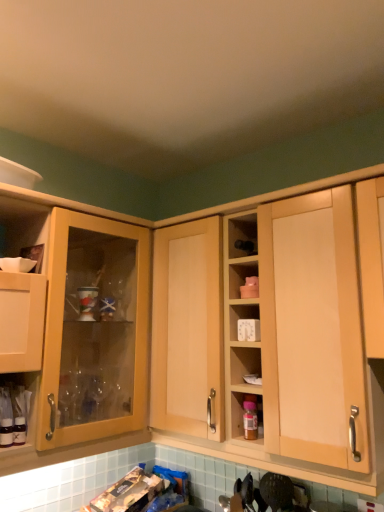
Question: Considering the relative sizes of translucent glass bottles at lower left and matte wood cabinet at left, positioned as the first cabinetry in left-to-right order, in the image provided, is translucent glass bottles at lower left taller than matte wood cabinet at left, positioned as the first cabinetry in left-to-right order,?

Choices:
 (A) no
 (B) yes

Answer: (A)

Question: Is translucent glass bottles at lower left bigger than matte wood cabinet at left, positioned as the 2th cabinetry in right-to-left order?

Choices:
 (A) yes
 (B) no

Answer: (B)

Question: Is translucent glass bottles at lower left turned away from matte wood cabinet at left, positioned as the 2th cabinetry in right-to-left order?

Choices:
 (A) no
 (B) yes

Answer: (B)

Question: From a real-world perspective, is translucent glass bottles at lower left physically above matte wood cabinet at left, positioned as the 2th cabinetry in right-to-left order?

Choices:
 (A) no
 (B) yes

Answer: (A)

Question: Considering the relative sizes of translucent glass bottles at lower left and matte wood cabinet at left, positioned as the 2th cabinetry in right-to-left order, in the image provided, is translucent glass bottles at lower left thinner than matte wood cabinet at left, positioned as the 2th cabinetry in right-to-left order,?

Choices:
 (A) yes
 (B) no

Answer: (A)

Question: From the image's perspective, is translucent glass bottles at lower left under matte wood cabinet at left, positioned as the 2th cabinetry in right-to-left order?

Choices:
 (A) no
 (B) yes

Answer: (B)

Question: Is the depth of translucent plastic bottle at center-right greater than that of matte wood cabinet at left, positioned as the first cabinetry in left-to-right order?

Choices:
 (A) no
 (B) yes

Answer: (B)

Question: Does translucent plastic bottle at center-right have a greater height compared to matte wood cabinet at left, positioned as the 2th cabinetry in right-to-left order?

Choices:
 (A) yes
 (B) no

Answer: (B)

Question: Does translucent plastic bottle at center-right contain matte wood cabinet at left, positioned as the 2th cabinetry in right-to-left order?

Choices:
 (A) no
 (B) yes

Answer: (A)

Question: Does translucent plastic bottle at center-right have a larger size compared to matte wood cabinet at left, positioned as the first cabinetry in left-to-right order?

Choices:
 (A) yes
 (B) no

Answer: (B)

Question: Can you confirm if translucent plastic bottle at center-right is shorter than matte wood cabinet at left, positioned as the first cabinetry in left-to-right order?

Choices:
 (A) yes
 (B) no

Answer: (A)

Question: Is translucent plastic bottle at center-right positioned beyond the bounds of matte wood cabinet at left, positioned as the first cabinetry in left-to-right order?

Choices:
 (A) yes
 (B) no

Answer: (A)

Question: Is the surface of matte wood cabinet at left, positioned as the first cabinetry in left-to-right order, in direct contact with light wood cabinet at center, which is the first cabinetry from right to left?

Choices:
 (A) no
 (B) yes

Answer: (A)